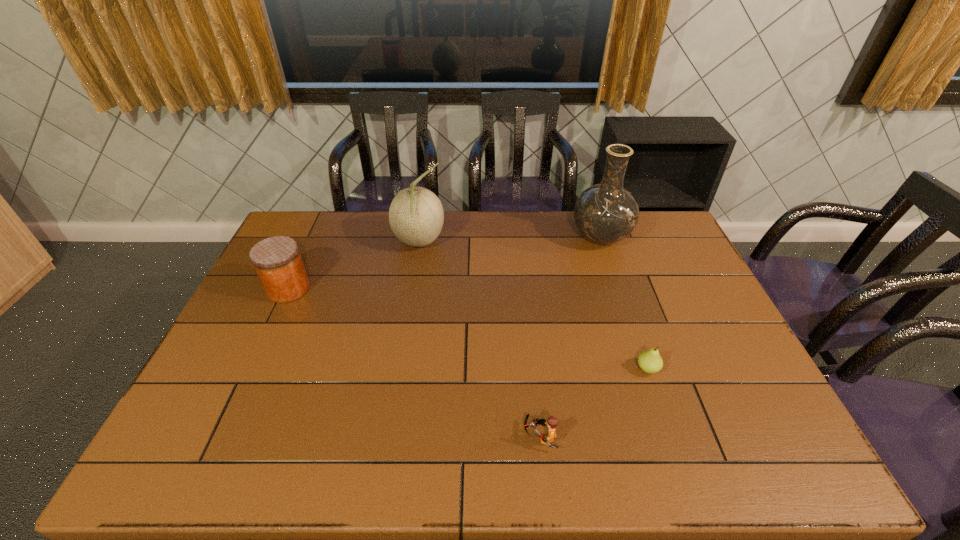
The height and width of the screenshot is (540, 960). I want to click on free space at the near edge of the desktop, so click(313, 469).

Where is `vacant space at the right edge of the desktop`? The height and width of the screenshot is (540, 960). vacant space at the right edge of the desktop is located at coordinates (694, 272).

In the image, there is a desktop. Find the location of `vacant space at the far left corner`. vacant space at the far left corner is located at coordinates (308, 227).

This screenshot has width=960, height=540. What are the coordinates of `vacant area at the near left corner` in the screenshot? It's located at (165, 460).

This screenshot has width=960, height=540. Identify the location of free space between the cantaloup and the third nearest object. (354, 266).

The width and height of the screenshot is (960, 540). Find the location of `free spot between the pear and the nearest object`. free spot between the pear and the nearest object is located at coordinates (593, 403).

Identify the location of empty space between the tallest object and the third object from right to left. This screenshot has width=960, height=540. (570, 337).

You are a GUI agent. You are given a task and a screenshot of the screen. Output one action in this format:
    pyautogui.click(x=<x>, y=<y>)
    Task: Click on the empty space between the vase and the pear
    
    Given the screenshot: What is the action you would take?
    pyautogui.click(x=624, y=303)

The width and height of the screenshot is (960, 540). Identify the location of free space that is in between the pear and the jar. click(468, 329).

Where is `free point between the second tallest object and the third object from right to left`? free point between the second tallest object and the third object from right to left is located at coordinates point(479,339).